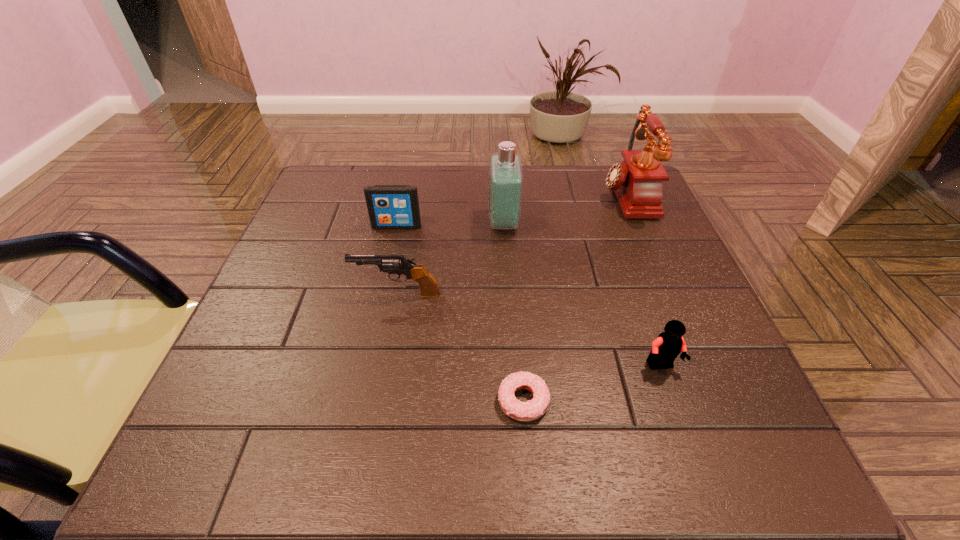
This screenshot has height=540, width=960. In order to click on object that is the fourth closest to the gun in this screenshot , I will do `click(666, 347)`.

The image size is (960, 540). In order to click on free space that satisfies the following two spatial constraints: 1. along the barrel of the fourth farthest object; 2. on the front screen of the iPod in this screenshot , I will do `click(410, 226)`.

Identify the location of free spot that satisfies the following two spatial constraints: 1. on the front screen of the iPod; 2. along the barrel of the third nearest object. (381, 294).

At what (x,y) coordinates should I click in order to perform the action: click on blank space that satisfies the following two spatial constraints: 1. on the dial of the telephone; 2. on the front-facing side of the Lego. Please return your answer as a coordinate pair (x, y). Looking at the image, I should click on (697, 366).

Locate an element on the screen. This screenshot has height=540, width=960. free space that satisfies the following two spatial constraints: 1. on the front label of the perfume; 2. on the right side of the shortest object is located at coordinates (515, 401).